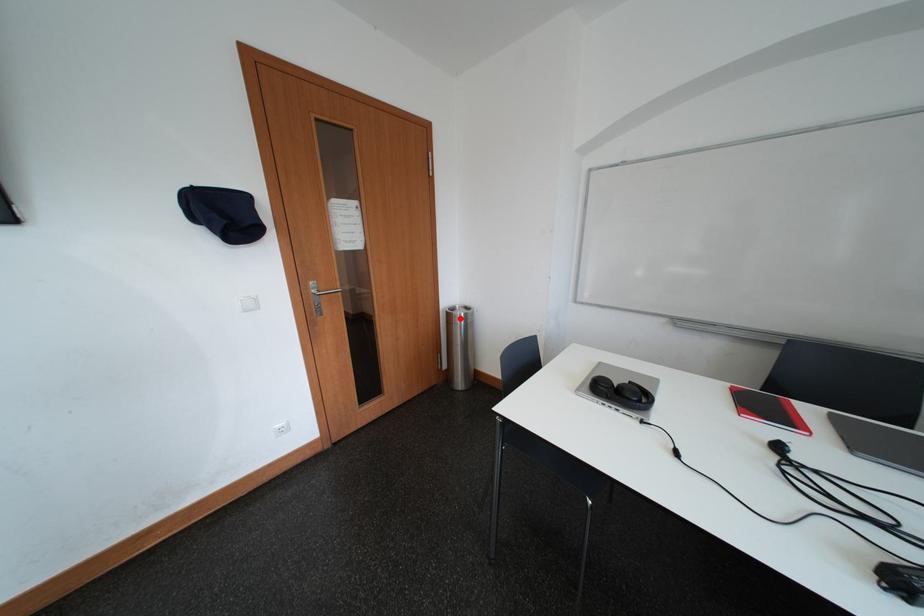
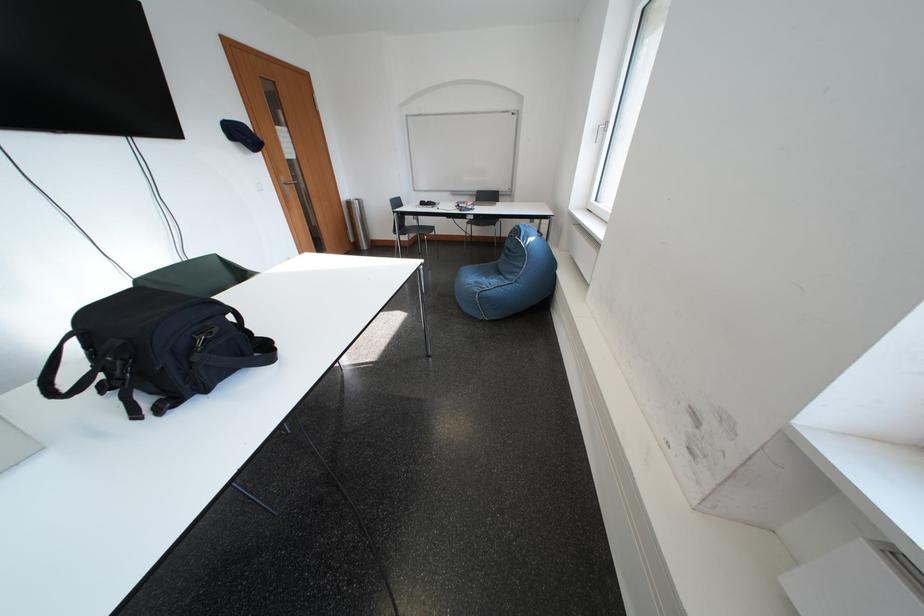
Question: I am providing you with two images of the same scene from different viewpoints. A red point is marked on the first image. Is the red point's position out of view in image 2?

Choices:
 (A) Yes
 (B) No

Answer: (B)